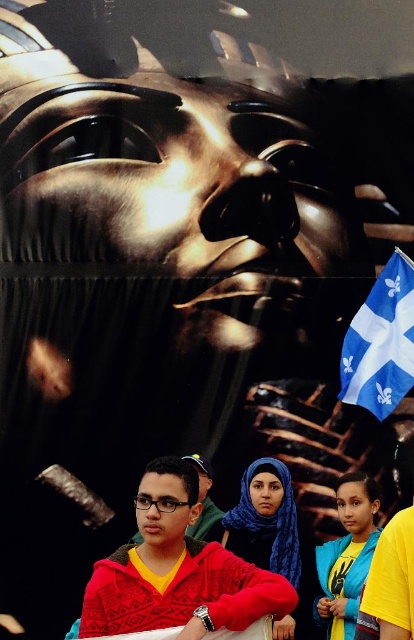
Between blue fabric hijab at center and blue fabric flag at lower right, which one has more height?

blue fabric flag at lower right

Is blue fabric hijab at center bigger than blue fabric flag at lower right?

Indeed, blue fabric hijab at center has a larger size compared to blue fabric flag at lower right.

Is point (269, 492) in front of point (372, 385)?

Yes, it is.

Where is `blue fabric hijab at center`? Image resolution: width=414 pixels, height=640 pixels. blue fabric hijab at center is located at coordinates (271, 538).

Does blue fabric hijab at center appear on the right side of blue fabric hijab at lower center?

In fact, blue fabric hijab at center is to the left of blue fabric hijab at lower center.

Does blue fabric hijab at center appear on the left side of blue fabric hijab at lower center?

Correct, you'll find blue fabric hijab at center to the left of blue fabric hijab at lower center.

Where is `blue fabric hijab at center`? The width and height of the screenshot is (414, 640). blue fabric hijab at center is located at coordinates (271, 538).

Where is `blue fabric hijab at center`? Image resolution: width=414 pixels, height=640 pixels. blue fabric hijab at center is located at coordinates (271, 538).

Between point (312, 561) and point (199, 472), which one is positioned behind?

Point (199, 472)

Does blue fabric hijab at center come in front of matte red hoodie at lower left?

Yes, blue fabric hijab at center is in front of matte red hoodie at lower left.

Does point (240, 538) lie in front of point (204, 490)?

That is True.

Identify the location of blue fabric hijab at center. The image size is (414, 640). (271, 538).